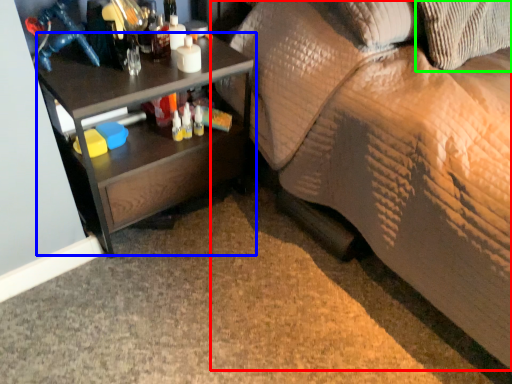
Question: Which is nearer to the studio couch (highlighted by a red box)? desk (highlighted by a blue box) or pillow (highlighted by a green box).

Choices:
 (A) desk
 (B) pillow

Answer: (B)